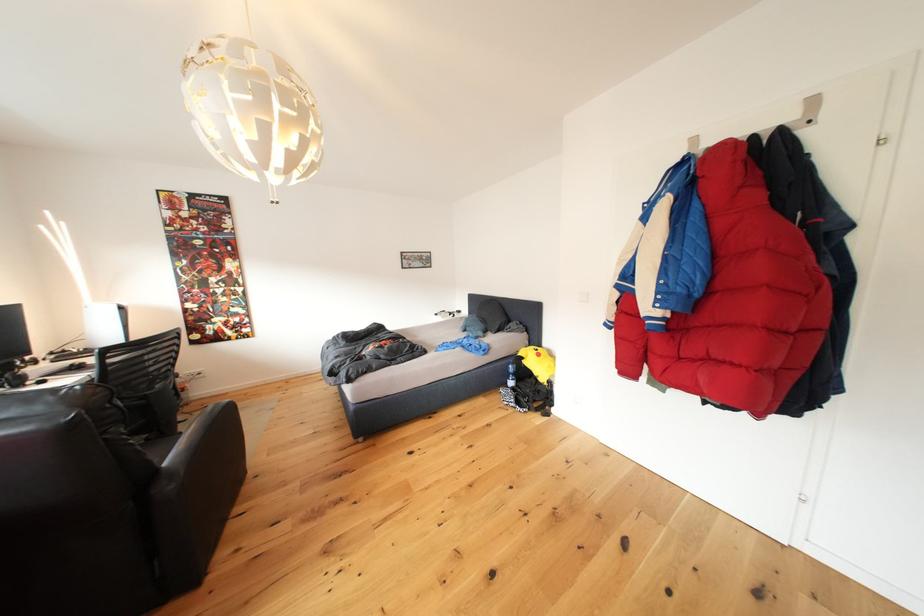
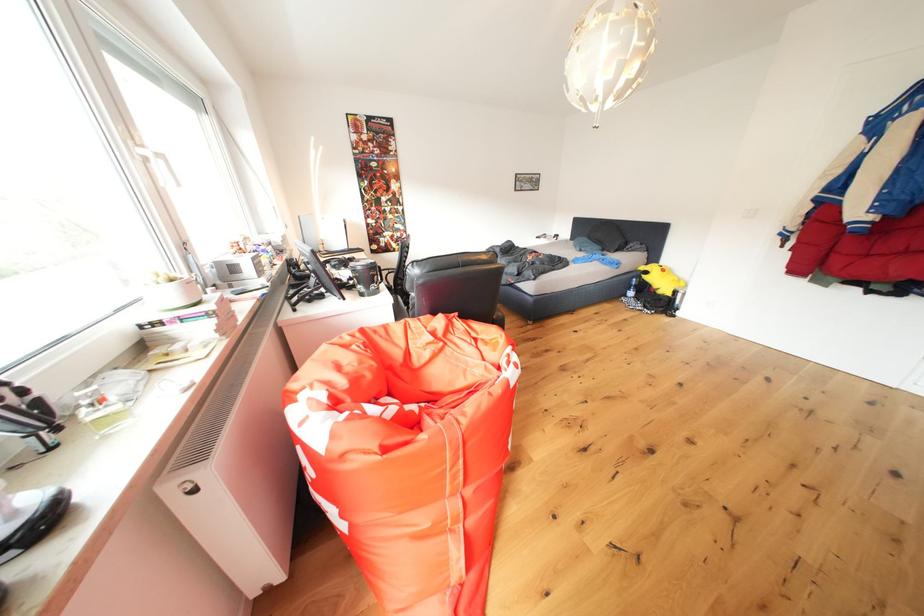
In a continuous first-person perspective shot, in which direction is the camera moving?

The movement direction of the cameraman is left, backward.